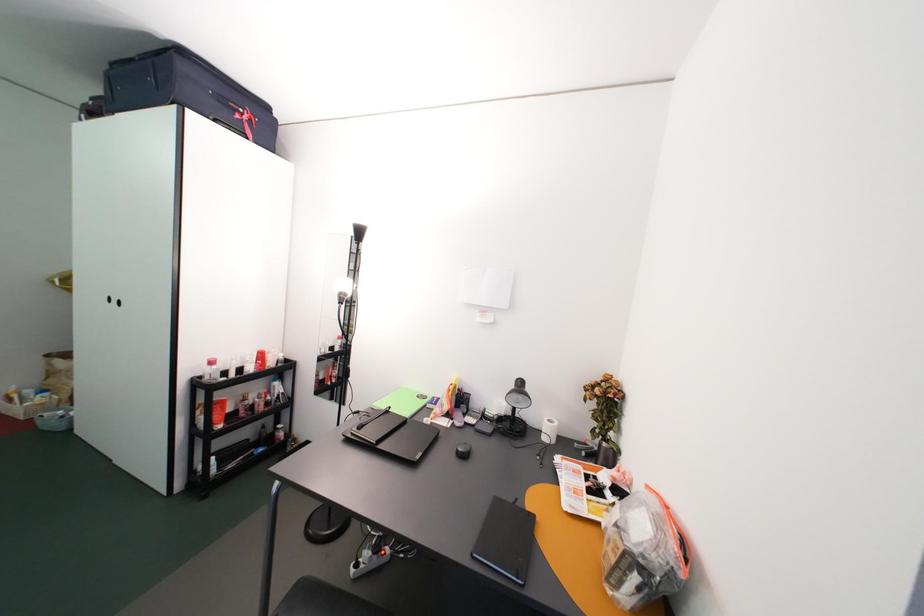
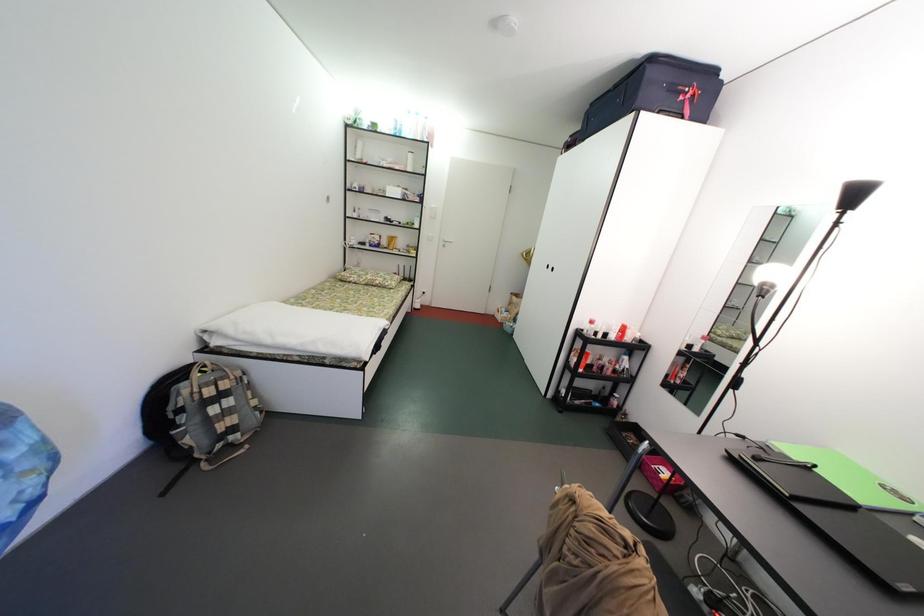
Question: The camera is either moving clockwise (left) or counter-clockwise (right) around the object. The first image is from the beginning of the video and the second image is from the end. Is the camera moving left or right when shooting the video?

Choices:
 (A) Left
 (B) Right

Answer: (B)